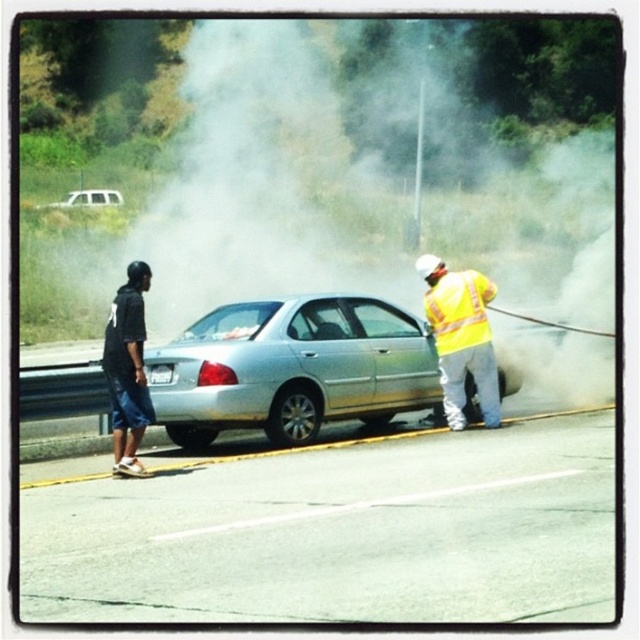
Does smooth asphalt highway at center appear over reflective yellow vest at right?

Actually, smooth asphalt highway at center is below reflective yellow vest at right.

This screenshot has width=640, height=640. What do you see at coordinates (337, 531) in the screenshot? I see `smooth asphalt highway at center` at bounding box center [337, 531].

I want to click on smooth asphalt highway at center, so click(x=337, y=531).

Which is more to the left, reflective yellow vest at right or dark blue denim shorts at left?

dark blue denim shorts at left is more to the left.

Which of these two, reflective yellow vest at right or dark blue denim shorts at left, stands taller?

reflective yellow vest at right

Locate an element on the screen. reflective yellow vest at right is located at coordinates (460, 337).

The width and height of the screenshot is (640, 640). I want to click on reflective yellow vest at right, so click(x=460, y=337).

Who is more distant from viewer, (340, 356) or (458, 288)?

Positioned behind is point (458, 288).

Is silver metallic car at center taller than yellow reflective safety vest at center-right?

Correct, silver metallic car at center is much taller as yellow reflective safety vest at center-right.

I want to click on silver metallic car at center, so click(291, 369).

This screenshot has height=640, width=640. What are the coordinates of `silver metallic car at center` in the screenshot? It's located at click(291, 369).